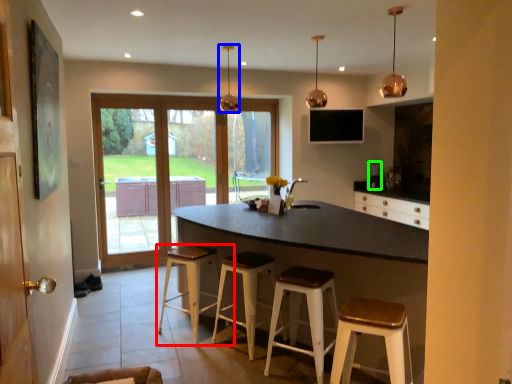
Question: Which is nearer to the stool (highlighted by a red box)? light fixture (highlighted by a blue box) or appliance (highlighted by a green box).

Choices:
 (A) light fixture
 (B) appliance

Answer: (A)